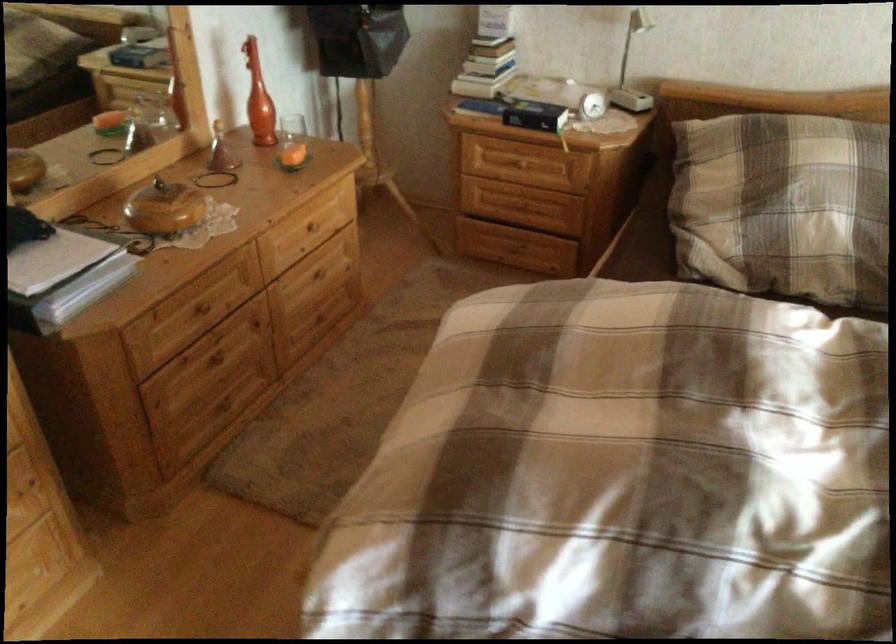
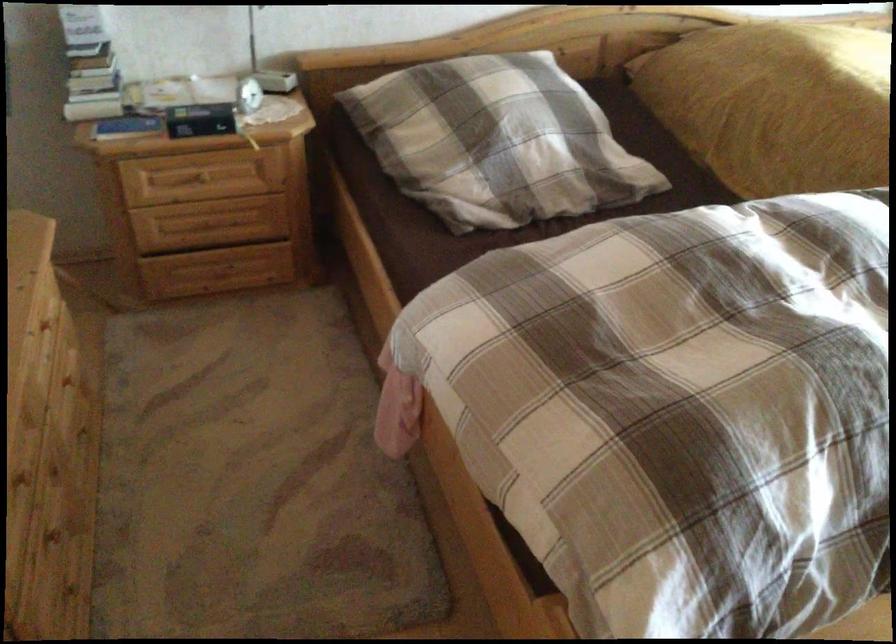
Question: Based on the continuous images, in which direction is the camera rotating? Reply with the corresponding letter.

Choices:
 (A) Left
 (B) Right
 (C) Up
 (D) Down

Answer: (B)